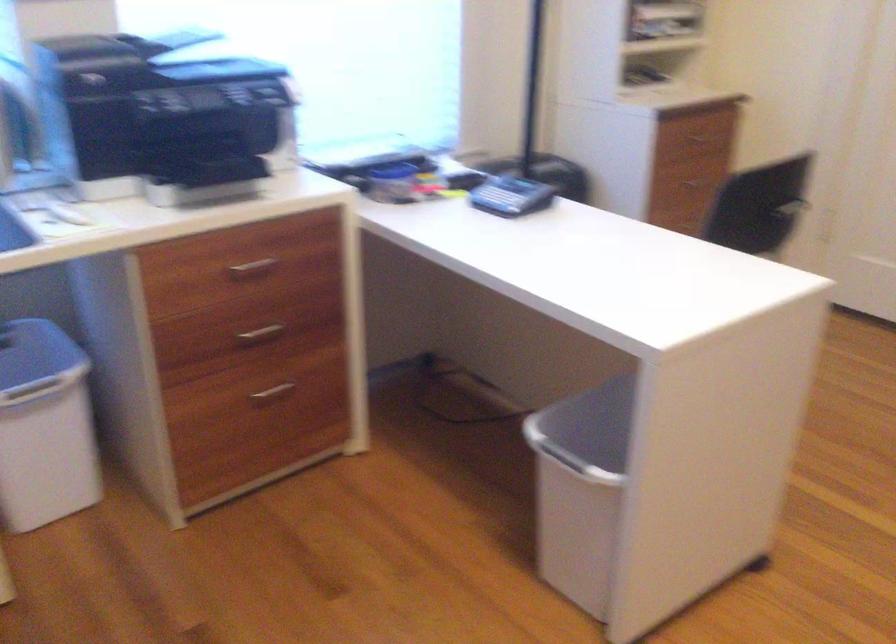
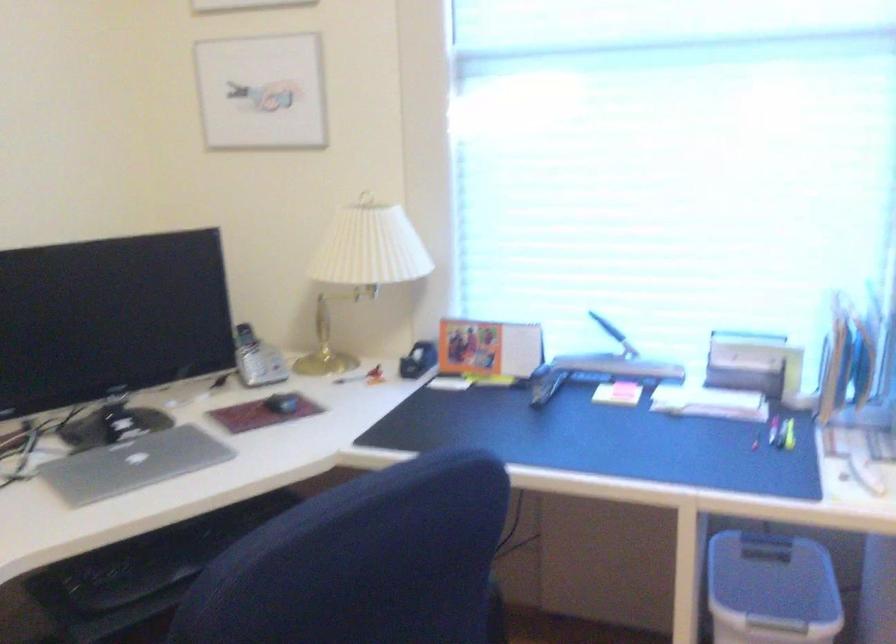
Question: The camera is either moving clockwise (left) or counter-clockwise (right) around the object. The first image is from the beginning of the video and the second image is from the end. Is the camera moving left or right when shooting the video?

Choices:
 (A) Left
 (B) Right

Answer: (B)